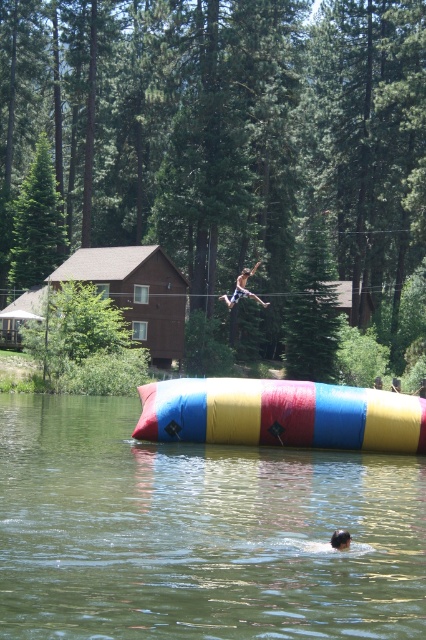
Question: Which point is farther to the camera?

Choices:
 (A) (336, 547)
 (B) (227, 304)
 (C) (393, 529)

Answer: (B)

Question: Estimate the real-world distances between objects in this image. Which object is farther from the transparent inflatable at center?

Choices:
 (A) tan skin/striped shorts at center
 (B) smooth skin person at center

Answer: (A)

Question: Does transparent inflatable at center come in front of tan skin/striped shorts at center?

Choices:
 (A) yes
 (B) no

Answer: (A)

Question: Observing the image, what is the correct spatial positioning of transparent inflatable at center in reference to smooth skin person at center?

Choices:
 (A) below
 (B) above

Answer: (A)

Question: Among these points, which one is nearest to the camera?

Choices:
 (A) (256, 298)
 (B) (348, 547)

Answer: (B)

Question: Can you confirm if transparent inflatable at center is smaller than smooth skin person at center?

Choices:
 (A) no
 (B) yes

Answer: (A)